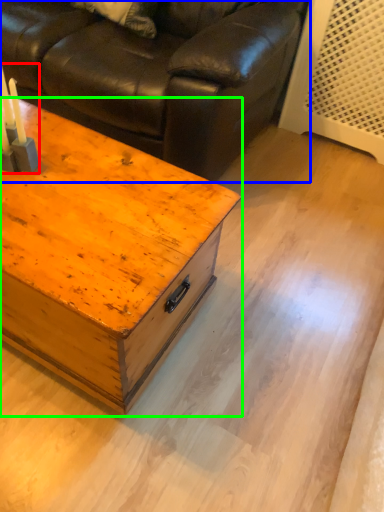
Question: Which is farther away from candle holder (highlighted by a red box)? studio couch (highlighted by a blue box) or table (highlighted by a green box)?

Choices:
 (A) studio couch
 (B) table

Answer: (A)